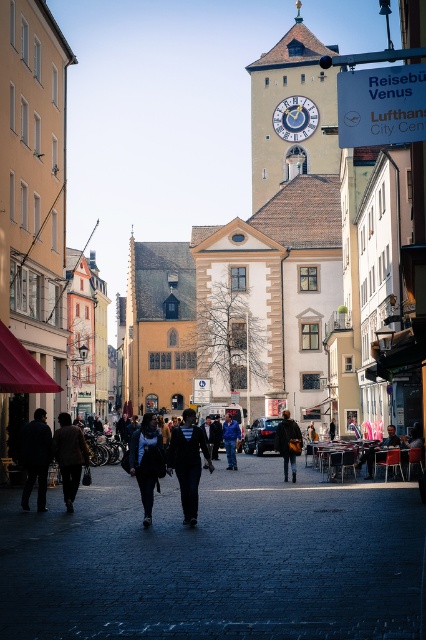
Question: Which point is farther to the camera?

Choices:
 (A) dark gray jacket at lower left
 (B) dark brown leather jacket at lower left
 (C) dark blue fabric coat at center
 (D) dark brown leather jacket at center

Answer: (A)

Question: Considering the relative positions of dark blue fabric coat at center and dark blue jeans at center in the image provided, where is dark blue fabric coat at center located with respect to dark blue jeans at center?

Choices:
 (A) left
 (B) right

Answer: (A)

Question: Which is nearer to the dark gray jacket at lower left?

Choices:
 (A) dark blue jeans at center
 (B) dark blue leather jacket at center
 (C) black leather jacket at center

Answer: (C)

Question: Which is nearer to the dark brown leather jacket at center?

Choices:
 (A) dark blue leather jacket at center
 (B) dark blue jeans at center
 (C) black leather jacket at center

Answer: (C)

Question: Can you confirm if black leather jacket at center is positioned to the left of dark brown leather jacket at lower left?

Choices:
 (A) no
 (B) yes

Answer: (A)

Question: Is dark gray jacket at lower left further to camera compared to blue fabric jacket at center?

Choices:
 (A) yes
 (B) no

Answer: (B)